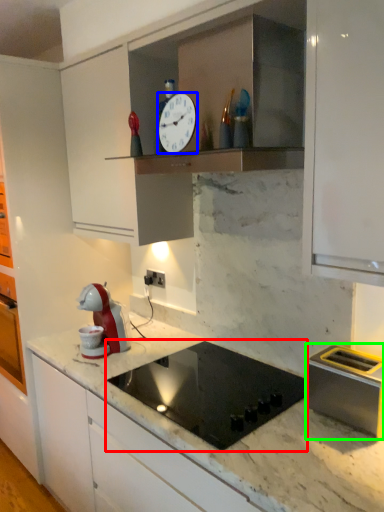
Question: Which object is the farthest from gas stove (highlighted by a red box)? Choose among these: clock (highlighted by a blue box) or kitchen appliance (highlighted by a green box).

Choices:
 (A) clock
 (B) kitchen appliance

Answer: (A)